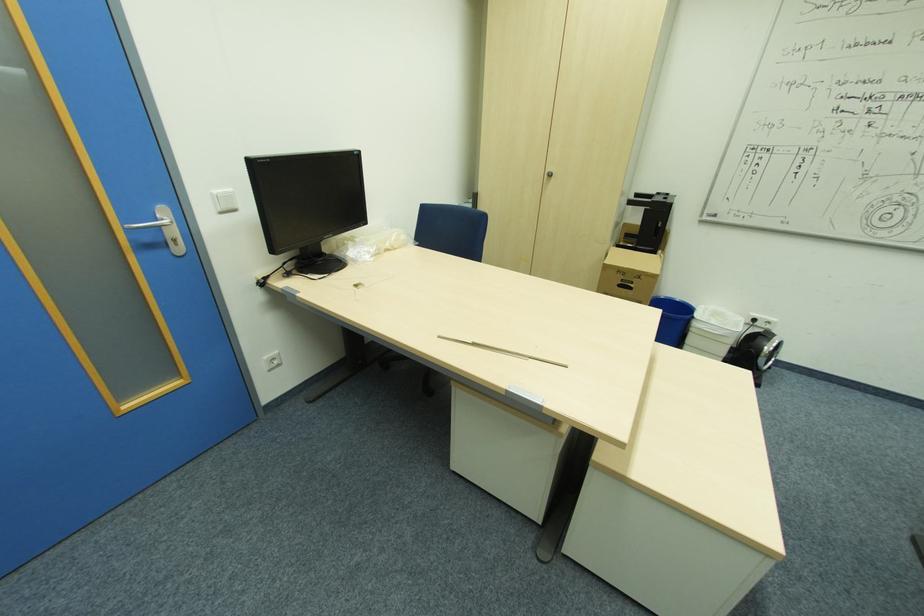
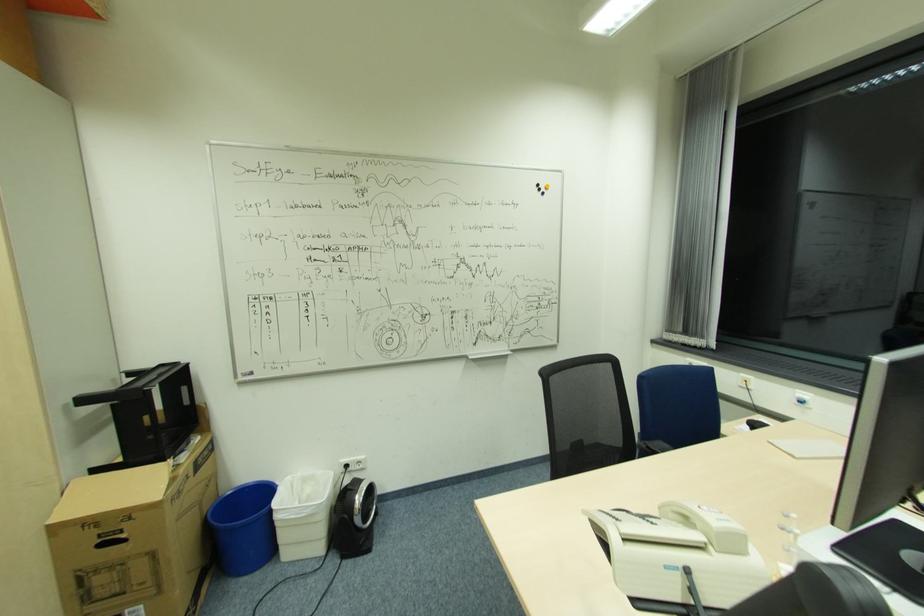
Locate, in the second image, the point that corresponds to [755,350] in the first image.

(347, 515)